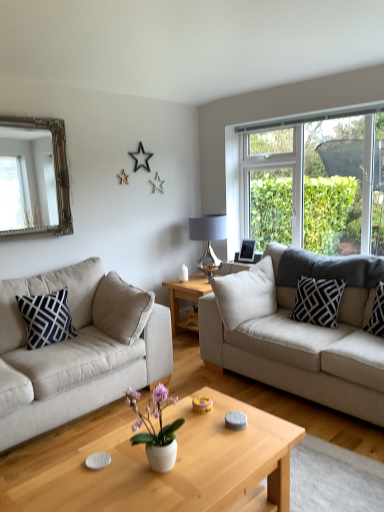
Where is `vacant space in front of white ceramic pot at center`? The width and height of the screenshot is (384, 512). vacant space in front of white ceramic pot at center is located at coordinates (155, 499).